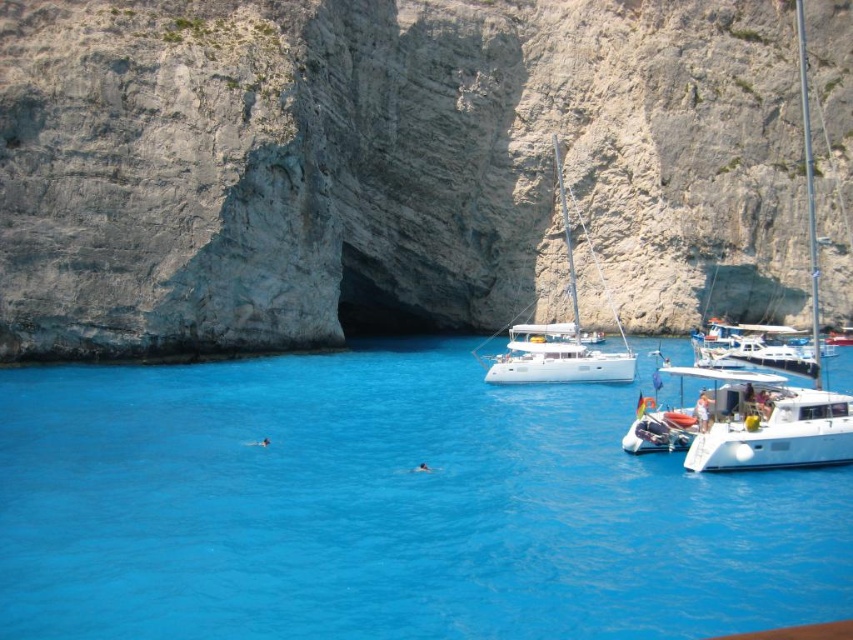
Question: Can you confirm if white glossy catamaran at lower right is positioned below white glossy sailboat at center?

Choices:
 (A) no
 (B) yes

Answer: (B)

Question: Among these points, which one is farthest from the camera?

Choices:
 (A) (795, 426)
 (B) (827, 397)

Answer: (B)

Question: Which point appears closest to the camera in this image?

Choices:
 (A) (796, 406)
 (B) (0, 508)
 (C) (190, 248)

Answer: (B)

Question: Is gray rocky cliff at center to the left of transparent blue water at center from the viewer's perspective?

Choices:
 (A) yes
 (B) no

Answer: (B)

Question: Considering the relative positions of gray rocky cliff at center and white glossy sailboat at center in the image provided, where is gray rocky cliff at center located with respect to white glossy sailboat at center?

Choices:
 (A) below
 (B) above

Answer: (B)

Question: Which object is positioned farthest from the white glossy sailboat at center?

Choices:
 (A) gray rocky cliff at center
 (B) white glossy catamaran at lower right
 (C) white glossy sailboat at right

Answer: (B)